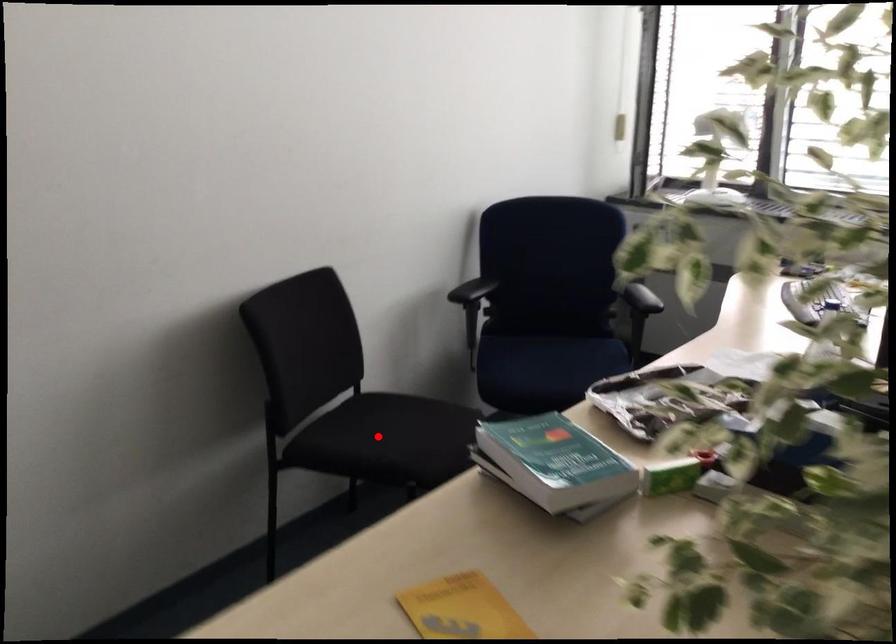
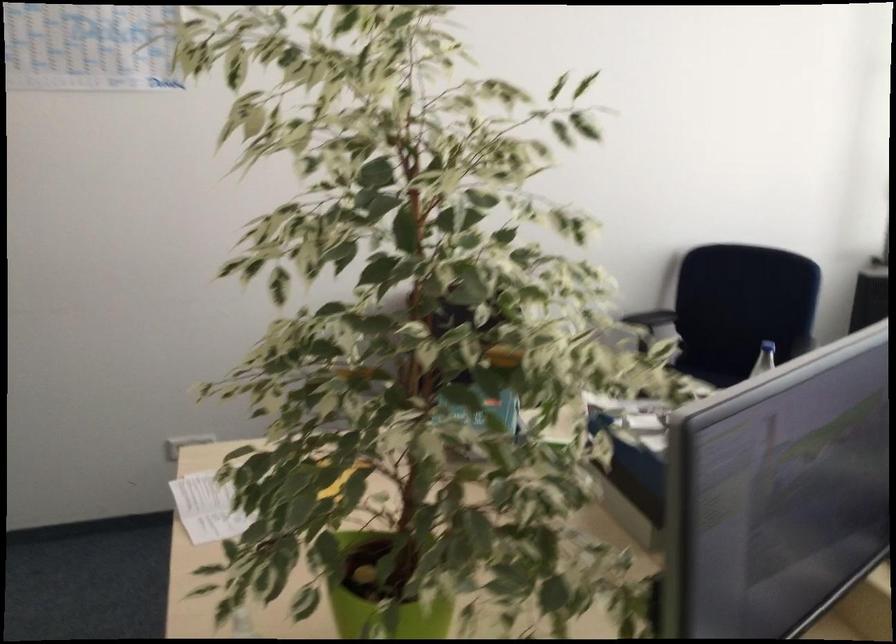
Question: I am providing you with two images of the same scene from different viewpoints. A red point is marked on the first image. Is the red point's position out of view in image 2?

Choices:
 (A) Yes
 (B) No

Answer: (A)